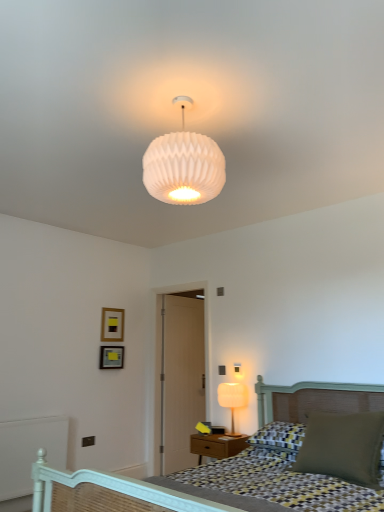
Find the location of `empty space that is ontop of white ribbed glass lampshade at upper center, marked as the 2th lamp in a right-to-left arrangement (from a real-world perspective)`. empty space that is ontop of white ribbed glass lampshade at upper center, marked as the 2th lamp in a right-to-left arrangement (from a real-world perspective) is located at coordinates (192, 97).